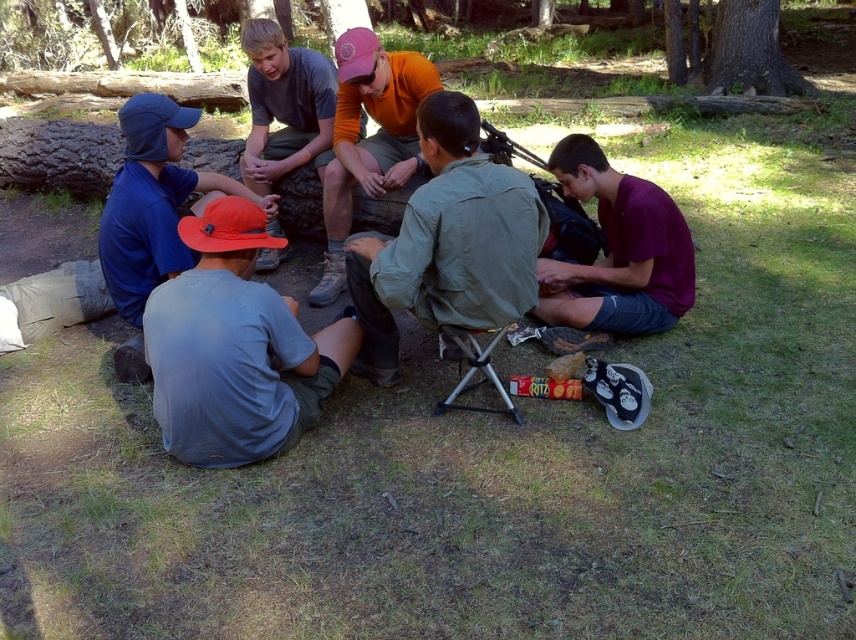
You are a photographer trying to capture a photo of the blue fabric cap at left and the orange cotton shirt at center. Based on their positions, which object should you focus on first if you want to ensure both are in the frame without moving the camera?

The blue fabric cap at left is located below the orange cotton shirt at center, so you should focus on the orange cotton shirt at center first to ensure both are in the frame without moving the camera.

You are standing at the center of the image. Which direction should you move to reach the gray cotton shirt at lower left?

You should move to the lower left direction to reach the gray cotton shirt at lower left.